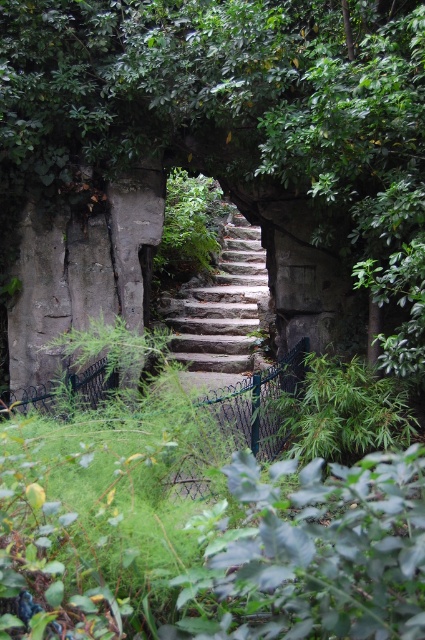
Image resolution: width=425 pixels, height=640 pixels. What do you see at coordinates (221, 104) in the screenshot?
I see `green leafy tree at center` at bounding box center [221, 104].

Is green leafy tree at center positioned before stone stairs at center?

That is True.

Between point (102, 141) and point (175, 310), which one is positioned in front?

Point (102, 141) is more forward.

Where is `green leafy tree at center`? green leafy tree at center is located at coordinates (221, 104).